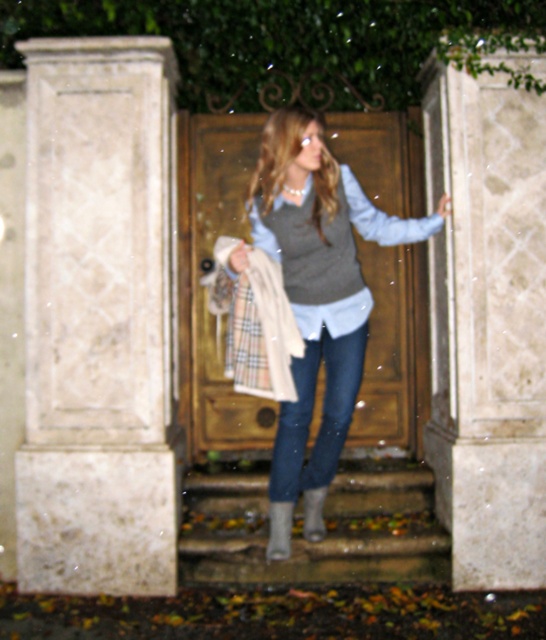
Is leather-like gray boot at center positioned at the back of grey suede boot at lower center?

Yes, it is behind grey suede boot at lower center.

Does leather-like gray boot at center have a greater height compared to grey suede boot at lower center?

Indeed, leather-like gray boot at center has a greater height compared to grey suede boot at lower center.

Who is more distant from viewer, (262,508) or (314,515)?

The point (262,508) is more distant.

Where is `leather-like gray boot at center`? leather-like gray boot at center is located at coordinates (301, 528).

Is leather boot at lower center shorter than grey suede boot at lower center?

No.

Can you confirm if leather boot at lower center is positioned below grey suede boot at lower center?

Yes.

Which is behind, point (281, 525) or point (313, 490)?

The point (313, 490) is behind.

This screenshot has width=546, height=640. I want to click on leather boot at lower center, so click(x=280, y=531).

Looking at this image, does leather-like gray boot at center appear over leather boot at lower center?

Yes, leather-like gray boot at center is above leather boot at lower center.

Who is more forward, (352, 563) or (283, 550)?

Point (283, 550)

Where is `leather-like gray boot at center`? leather-like gray boot at center is located at coordinates (301, 528).